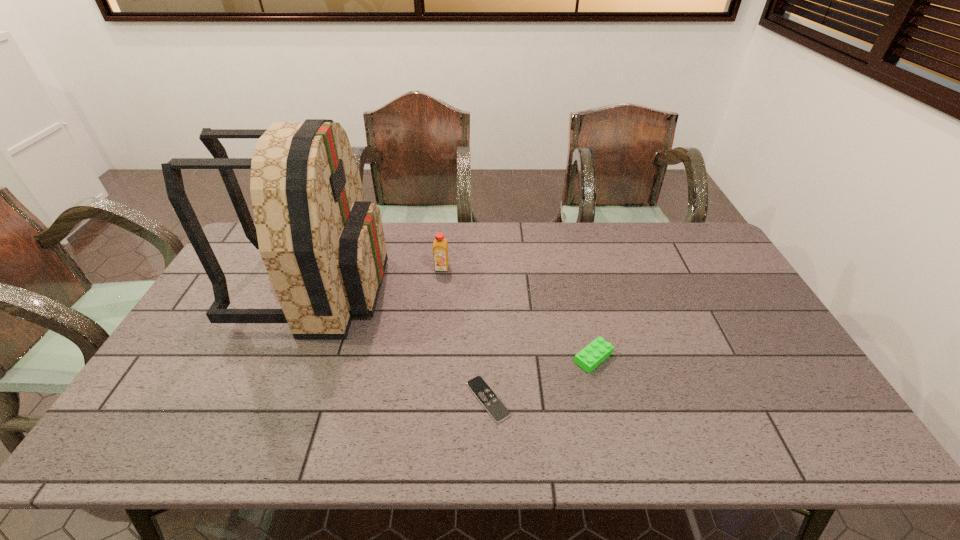
Identify the location of the leftmost object. (323, 245).

The height and width of the screenshot is (540, 960). I want to click on backpack, so click(x=323, y=245).

Find the location of `orange juice`. orange juice is located at coordinates (440, 250).

Locate an element on the screen. the second tallest object is located at coordinates [x=440, y=250].

This screenshot has width=960, height=540. I want to click on the third farthest object, so click(x=596, y=352).

Locate an element on the screen. The width and height of the screenshot is (960, 540). Lego is located at coordinates (596, 352).

Identify the location of the third object from left to right. (478, 386).

This screenshot has height=540, width=960. Identify the location of remote control. (478, 386).

This screenshot has height=540, width=960. What are the coordinates of `free location located 0.190m on the front face of the tallest object` in the screenshot? It's located at [x=444, y=288].

The width and height of the screenshot is (960, 540). Identify the location of free space located 0.280m on the front and back of the orange juice. (435, 338).